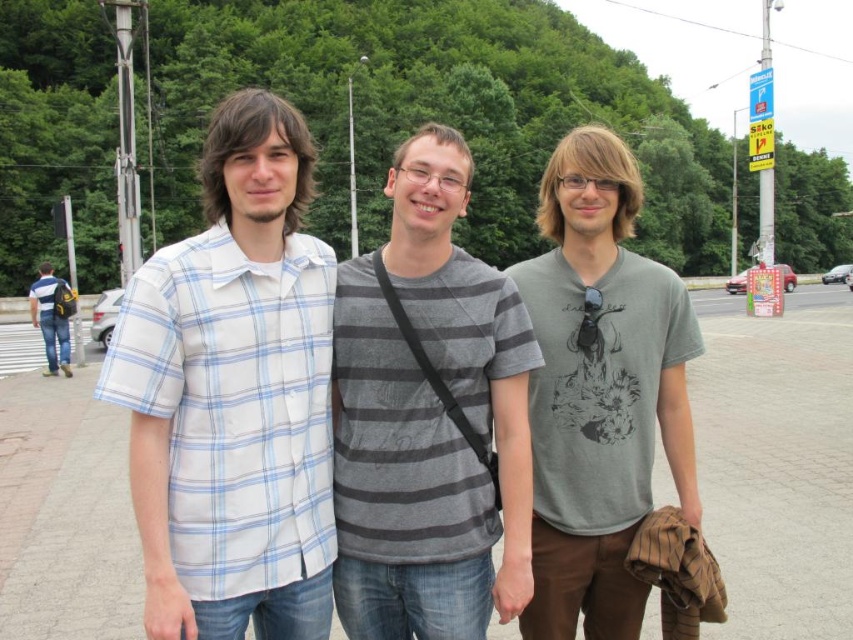
Is gray concrete pavement at center closer to camera compared to gray matte t-shirt at center?

No, it is behind gray matte t-shirt at center.

Is point (109, 600) closer to camera compared to point (534, 273)?

No.

Where is `gray concrete pavement at center`? The height and width of the screenshot is (640, 853). gray concrete pavement at center is located at coordinates (776, 461).

How far apart are white plaid shirt at left and gray concrete pavement at center?

They are 9.81 meters apart.

Between white plaid shirt at left and gray concrete pavement at center, which one is positioned lower?

Positioned lower is white plaid shirt at left.

Is point (123, 353) less distant than point (10, 403)?

Yes.

Find the location of a particular element. This screenshot has height=640, width=853. white plaid shirt at left is located at coordinates (234, 394).

Who is higher up, gray concrete pavement at center or matte blue jeans at left?

matte blue jeans at left

Image resolution: width=853 pixels, height=640 pixels. Identify the location of gray concrete pavement at center. (776, 461).

Identify the location of gray concrete pavement at center. The image size is (853, 640). (776, 461).